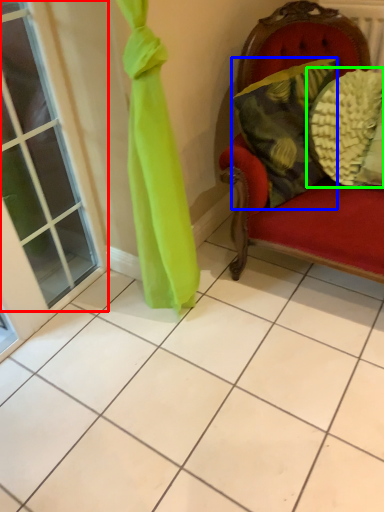
Question: Estimate the real-world distances between objects in this image. Which object is closer to window (highlighted by a red box), pillow (highlighted by a blue box) or pillow (highlighted by a green box)?

Choices:
 (A) pillow
 (B) pillow

Answer: (A)